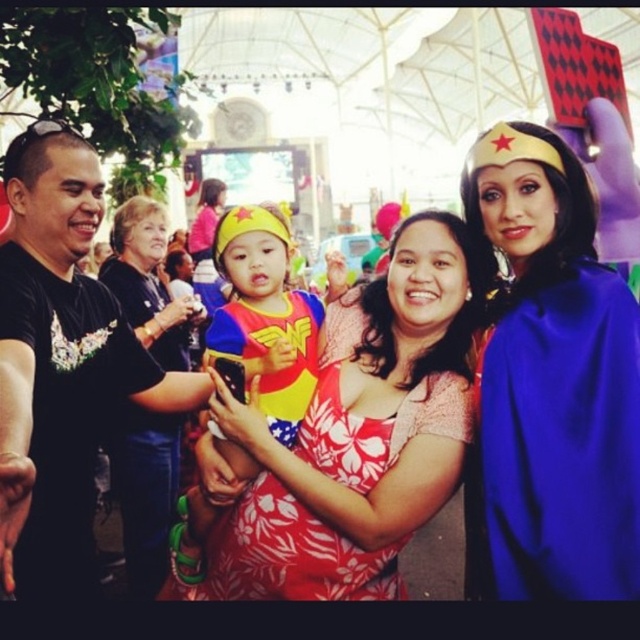
Question: Considering the real-world distances, which object is closest to the matte red dress at center?

Choices:
 (A) matte black shirt at left
 (B) black matte t-shirt at left

Answer: (B)

Question: Which point is closer to the camera taking this photo?

Choices:
 (A) (67, 208)
 (B) (115, 259)
 (C) (298, 508)

Answer: (C)

Question: Can you confirm if black matte t-shirt at left is positioned to the left of matte black shirt at left?

Choices:
 (A) no
 (B) yes

Answer: (B)

Question: Based on their relative distances, which object is nearer to the black matte t-shirt at left?

Choices:
 (A) blue satin cape at center
 (B) matte red dress at center
 (C) matte black shirt at left
 (D) matte yellow headband at center

Answer: (D)

Question: Can you confirm if blue satin cape at center is bigger than matte red dress at center?

Choices:
 (A) no
 (B) yes

Answer: (A)

Question: Does blue satin cape at center have a smaller size compared to matte black shirt at left?

Choices:
 (A) yes
 (B) no

Answer: (A)